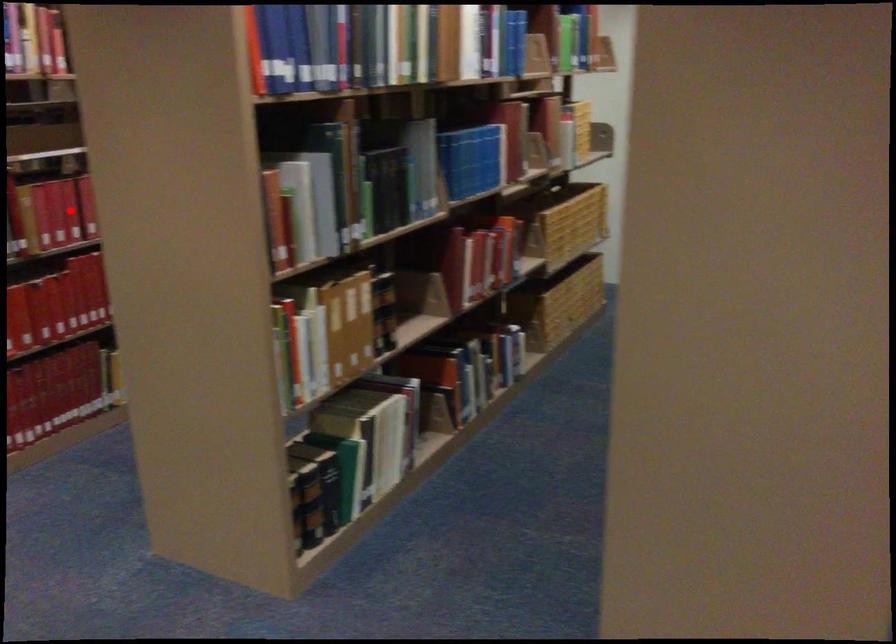
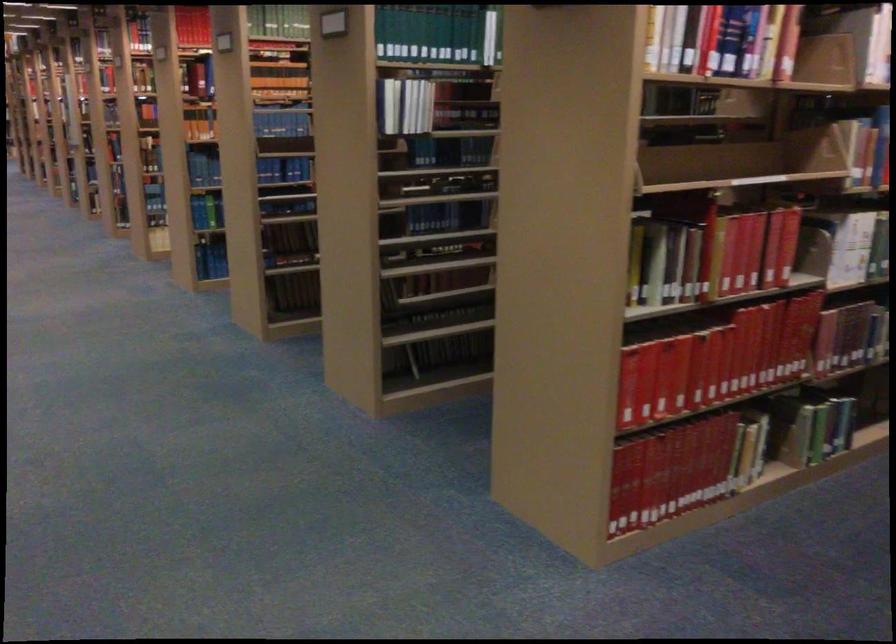
Locate, in the second image, the point that corresponds to the highlighted location in the first image.

(754, 250)